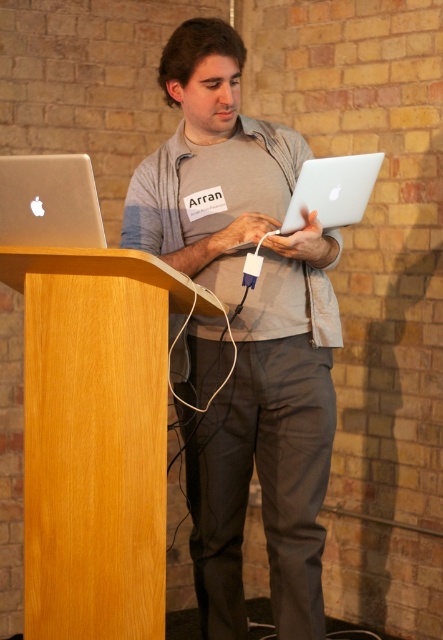
You are an event organizer setting up a presentation area. You have a matte gray laptop at center and a wooden podium at left. Where should you place the microphone stand so that it is between these two items?

The microphone stand should be placed between the matte gray laptop at center and the wooden podium at left, since the matte gray laptop at center is to the right of the wooden podium at left.

You are organizing a tech event and need to place two laptops on a podium for a presentation. The podium has limited space. Given the distance between the matte gray laptop at center and the silver metallic laptop at left, can you determine if they can be placed side by side without overlapping?

The matte gray laptop at center is 52.58 centimeters away from the silver metallic laptop at left. Since the distance between them is sufficient, they can be placed side by side without overlapping.